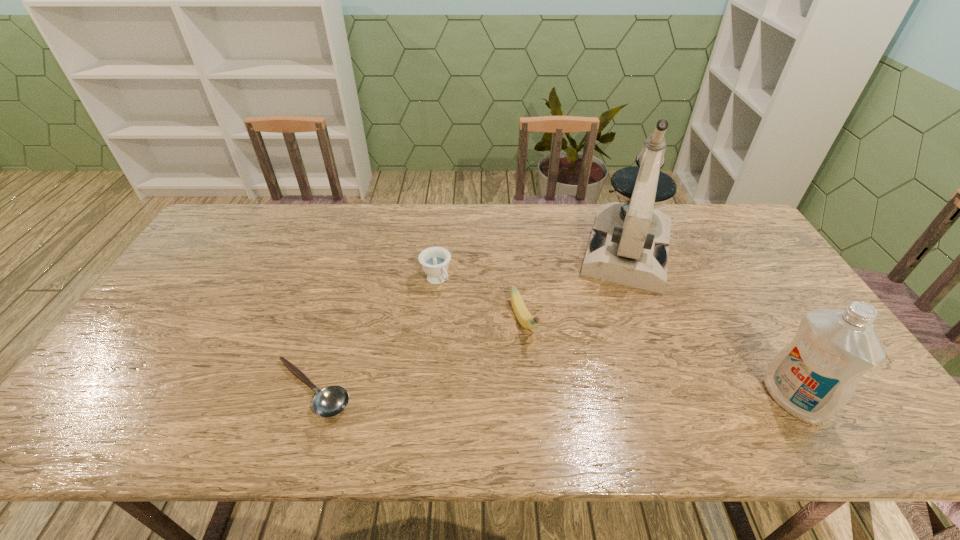
Where is `ladle located in the near edge section of the desktop`? The image size is (960, 540). ladle located in the near edge section of the desktop is located at coordinates (330, 401).

Identify the location of detergent at the near edge. (813, 378).

Locate an element on the screen. The width and height of the screenshot is (960, 540). object that is at the right edge is located at coordinates (813, 378).

Locate an element on the screen. Image resolution: width=960 pixels, height=540 pixels. object at the near right corner is located at coordinates (813, 378).

Locate an element on the screen. free region at the far edge is located at coordinates (437, 243).

Identify the location of free location at the near edge. (600, 391).

What are the coordinates of `free space at the left edge of the desktop` in the screenshot? It's located at (207, 298).

The image size is (960, 540). In order to click on vacant space at the right edge in this screenshot , I will do `click(720, 254)`.

Where is `vacant space that's between the detergent and the third object from right to left`? The width and height of the screenshot is (960, 540). vacant space that's between the detergent and the third object from right to left is located at coordinates (658, 360).

The width and height of the screenshot is (960, 540). I want to click on free space between the shortest object and the third farthest object, so click(418, 355).